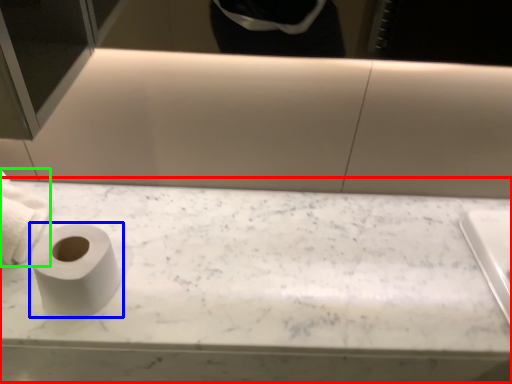
Question: Considering the real-world distances, which object is closest to counter top (highlighted by a red box)? toilet paper (highlighted by a blue box) or toilet paper (highlighted by a green box).

Choices:
 (A) toilet paper
 (B) toilet paper

Answer: (A)